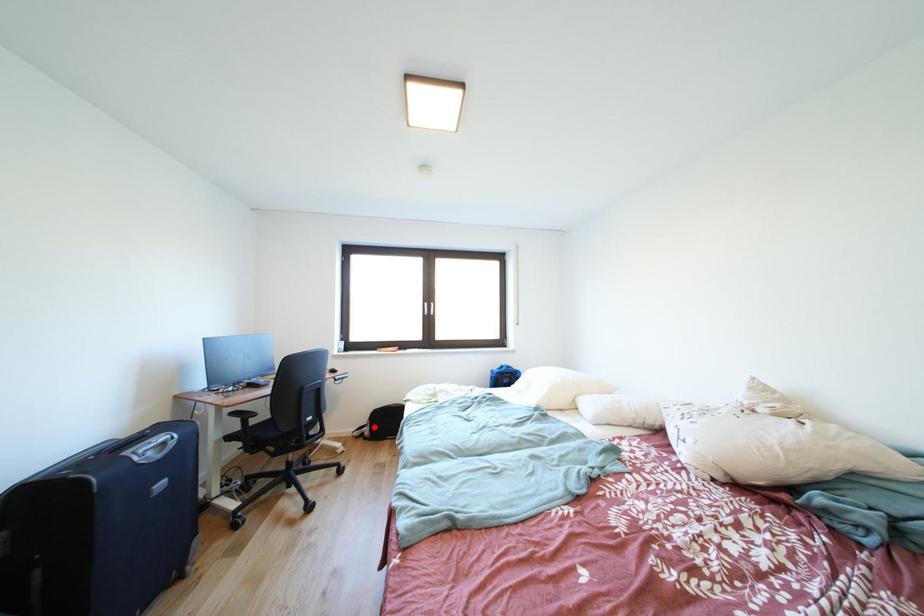
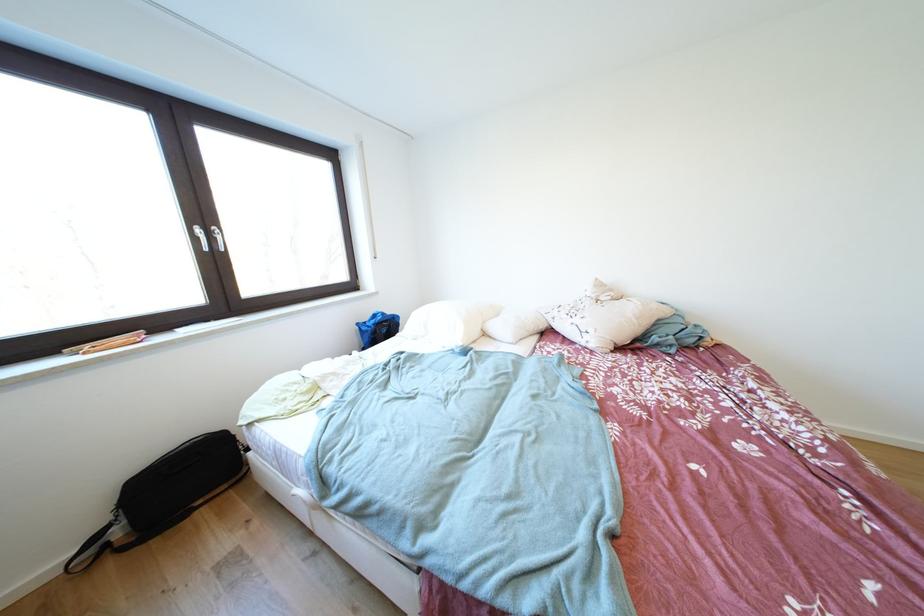
Locate, in the second image, the point that corresponds to the highlighted location in the first image.

(114, 524)